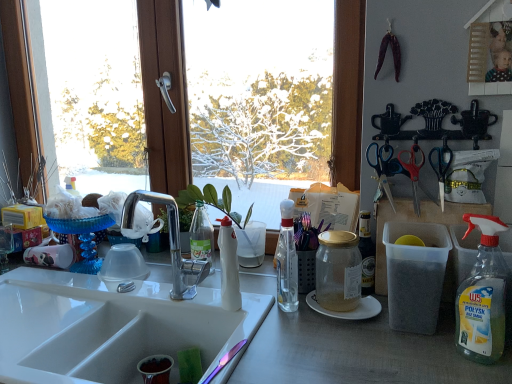
Where is `white ceramic sink at center`? Image resolution: width=512 pixels, height=384 pixels. white ceramic sink at center is located at coordinates (111, 327).

What do you see at coordinates (358, 352) in the screenshot? I see `white glossy sink at lower left` at bounding box center [358, 352].

The height and width of the screenshot is (384, 512). Describe the element at coordinates (484, 296) in the screenshot. I see `clear plastic bottle at right, the fourth bottle when ordered from left to right` at that location.

This screenshot has width=512, height=384. Find the location of `satin nickel faucet at sink center`. satin nickel faucet at sink center is located at coordinates (169, 243).

Is clear glass bottle at center, acting as the third bottle starting from the right, surrounding white paper plate at center?

Definitely not — white paper plate at center is not inside clear glass bottle at center, acting as the third bottle starting from the right.

The height and width of the screenshot is (384, 512). Find the location of `paper plate to the right of clear glass bottle at center, acting as the third bottle starting from the right`. paper plate to the right of clear glass bottle at center, acting as the third bottle starting from the right is located at coordinates (349, 311).

Is clear glass bottle at center, the second bottle in the left-to-right sequence, next to white paper plate at center and touching it?

No, clear glass bottle at center, the second bottle in the left-to-right sequence, is not touching white paper plate at center.

Can you confirm if clear glass bottle at center, the second bottle in the left-to-right sequence, is smaller than white paper plate at center?

Actually, clear glass bottle at center, the second bottle in the left-to-right sequence, might be larger than white paper plate at center.

Between white glossy sink at lower left and satin nickel faucet at sink center, which one has less height?

satin nickel faucet at sink center is shorter.

From the image's perspective, is white glossy sink at lower left on top of satin nickel faucet at sink center?

No.

Can you tell me how much white glossy sink at lower left and satin nickel faucet at sink center differ in facing direction?

0.822 degrees separate the facing orientations of white glossy sink at lower left and satin nickel faucet at sink center.

Would you say white glossy sink at lower left is inside or outside satin nickel faucet at sink center?

white glossy sink at lower left cannot be found inside satin nickel faucet at sink center.

From the image's perspective, does white matte bottle at center, which appears as the first bottle when viewed from the left, appear lower than white ceramic sink at center?

Actually, white matte bottle at center, which appears as the first bottle when viewed from the left, appears above white ceramic sink at center in the image.

Based on the photo, is the depth of white matte bottle at center, the fourth bottle from the right, greater than that of white ceramic sink at center?

That is True.

Who is shorter, white matte bottle at center, the fourth bottle from the right, or white ceramic sink at center?

white ceramic sink at center.

Is white matte bottle at center, the fourth bottle from the right, touching white ceramic sink at center?

white matte bottle at center, the fourth bottle from the right, is not next to white ceramic sink at center, and they're not touching.

Which is correct: gold glass jar at center, acting as the third bottle starting from the left, is inside red plastic scissors at upper right, the 2th scissors in the left-to-right sequence, or outside of it?

The correct answer is: outside.

Considering the positions of objects gold glass jar at center, acting as the third bottle starting from the left, and red plastic scissors at upper right, which is the 2th scissors from right to left, in the image provided, who is behind, gold glass jar at center, acting as the third bottle starting from the left, or red plastic scissors at upper right, which is the 2th scissors from right to left,?

red plastic scissors at upper right, which is the 2th scissors from right to left, is further away from the camera.

From the image's perspective, is gold glass jar at center, the 2th bottle viewed from the right, positioned above or below red plastic scissors at upper right, the 2th scissors in the left-to-right sequence?

Based on their image positions, gold glass jar at center, the 2th bottle viewed from the right, is located beneath red plastic scissors at upper right, the 2th scissors in the left-to-right sequence.

Identify the location of paper plate located behind the clear plastic bottle at right, positioned as the first bottle in right-to-left order. This screenshot has width=512, height=384. (349, 311).

Could you measure the distance between clear plastic bottle at right, positioned as the first bottle in right-to-left order, and white paper plate at center?

The distance of clear plastic bottle at right, positioned as the first bottle in right-to-left order, from white paper plate at center is 10.91 inches.

Is clear plastic bottle at right, positioned as the first bottle in right-to-left order, to the right of white paper plate at center from the viewer's perspective?

Yes, clear plastic bottle at right, positioned as the first bottle in right-to-left order, is to the right of white paper plate at center.

From the image's perspective, does clear plastic bottle at right, positioned as the first bottle in right-to-left order, appear lower than white paper plate at center?

No.

In the image, is white glossy sink at lower left on the left side or the right side of white ceramic sink at center?

Clearly, white glossy sink at lower left is on the right of white ceramic sink at center in the image.

Looking at their sizes, would you say white glossy sink at lower left is wider or thinner than white ceramic sink at center?

white glossy sink at lower left is wider than white ceramic sink at center.

Is white glossy sink at lower left positioned beyond the bounds of white ceramic sink at center?

Absolutely, white glossy sink at lower left is external to white ceramic sink at center.

Is blue plastic scissors at upper right, which is counted as the 3th scissors, starting from the left, inside the boundaries of blue plastic scissors at upper right, which appears as the 1th scissors when viewed from the left, or outside?

blue plastic scissors at upper right, which is counted as the 3th scissors, starting from the left, is spatially situated outside blue plastic scissors at upper right, which appears as the 1th scissors when viewed from the left.

Is blue plastic scissors at upper right, which is counted as the 3th scissors, starting from the left, to the right of blue plastic scissors at upper right, which appears as the 1th scissors when viewed from the left, from the viewer's perspective?

Indeed, blue plastic scissors at upper right, which is counted as the 3th scissors, starting from the left, is positioned on the right side of blue plastic scissors at upper right, which appears as the 1th scissors when viewed from the left.

Between blue plastic scissors at upper right, which is counted as the 3th scissors, starting from the left, and blue plastic scissors at upper right, which appears as the 1th scissors when viewed from the left, which one has larger size?

With larger size is blue plastic scissors at upper right, which appears as the 1th scissors when viewed from the left.

Could you measure the distance between blue plastic scissors at upper right, which is counted as the 3th scissors, starting from the left, and blue plastic scissors at upper right, which appears as the 1th scissors when viewed from the left?

A distance of 4.61 inches exists between blue plastic scissors at upper right, which is counted as the 3th scissors, starting from the left, and blue plastic scissors at upper right, which appears as the 1th scissors when viewed from the left.

The width and height of the screenshot is (512, 384). Identify the location of paper plate below the clear glass bottle at center, the second bottle in the left-to-right sequence (from a real-world perspective). (349, 311).

Where is `desk lying below the satin nickel faucet at sink center (from the image's perspective)`? desk lying below the satin nickel faucet at sink center (from the image's perspective) is located at coordinates (358, 352).

From the image, which object appears to be farther from satin nickel faucet at sink center, transparent glass window at center or blue plastic scissors at upper right, which is counted as the 3th scissors, starting from the left?

Among the two, blue plastic scissors at upper right, which is counted as the 3th scissors, starting from the left, is located further to satin nickel faucet at sink center.

From the image, which object appears to be nearer to clear glass bottle at center, acting as the third bottle starting from the right, white paper plate at center or gold glass jar at center, acting as the third bottle starting from the left?

Based on the image, gold glass jar at center, acting as the third bottle starting from the left, appears to be nearer to clear glass bottle at center, acting as the third bottle starting from the right.

In the scene shown: Estimate the real-world distances between objects in this image. Which object is further from clear glass bottle at center, the second bottle in the left-to-right sequence, white glossy coffee cup at left or white matte bottle at center, which appears as the first bottle when viewed from the left?

Among the two, white glossy coffee cup at left is located further to clear glass bottle at center, the second bottle in the left-to-right sequence.

When comparing their distances from gold glass jar at center, acting as the third bottle starting from the left, does satin nickel faucet at sink center or blue plastic scissors at upper right, placed as the 1th scissors when sorted from right to left, seem further?

The object further to gold glass jar at center, acting as the third bottle starting from the left, is satin nickel faucet at sink center.

Based on their spatial positions, is gold glass jar at center, acting as the third bottle starting from the left, or blue plastic scissors at upper right, arranged as the 3th scissors when viewed from the right, further from satin nickel faucet at sink center?

The object further to satin nickel faucet at sink center is blue plastic scissors at upper right, arranged as the 3th scissors when viewed from the right.

Considering their positions, is white paper plate at center positioned further to gold glass jar at center, the 2th bottle viewed from the right, than white glossy coffee cup at left?

white glossy coffee cup at left is further to gold glass jar at center, the 2th bottle viewed from the right.

Estimate the real-world distances between objects in this image. Which object is closer to white glossy coffee cup at left, blue plastic scissors at upper right, placed as the 1th scissors when sorted from right to left, or clear plastic bottle at right, positioned as the first bottle in right-to-left order?

Based on the image, blue plastic scissors at upper right, placed as the 1th scissors when sorted from right to left, appears to be nearer to white glossy coffee cup at left.

Estimate the real-world distances between objects in this image. Which object is closer to white glossy coffee cup at left, white paper plate at center or satin nickel faucet at sink center?

satin nickel faucet at sink center lies closer to white glossy coffee cup at left than the other object.

This screenshot has height=384, width=512. Identify the location of window between white glossy coffee cup at left and white matte bottle at center, which appears as the first bottle when viewed from the left, in the horizontal direction. (161, 96).

Identify the location of desk located between white ceramic sink at center and clear glass bottle at center, acting as the third bottle starting from the right, in the left-right direction. The height and width of the screenshot is (384, 512). (358, 352).

Locate an element on the screen. The height and width of the screenshot is (384, 512). scissors between blue plastic scissors at upper right, which appears as the 1th scissors when viewed from the left, and gold glass jar at center, the 2th bottle viewed from the right, in the up-down direction is located at coordinates (441, 167).

Identify the location of tap located between white glossy coffee cup at left and red plastic scissors at upper right, which is the 2th scissors from right to left, in the left-right direction. (169, 243).